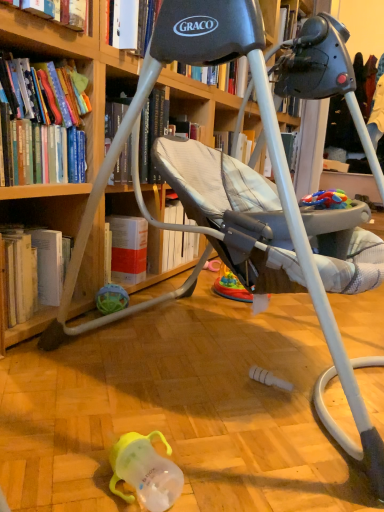
Locate an element on the screen. Image resolution: width=384 pixels, height=512 pixels. vacant space behind translucent rubber ball at lower left, which is the second toy from front to back is located at coordinates (142, 298).